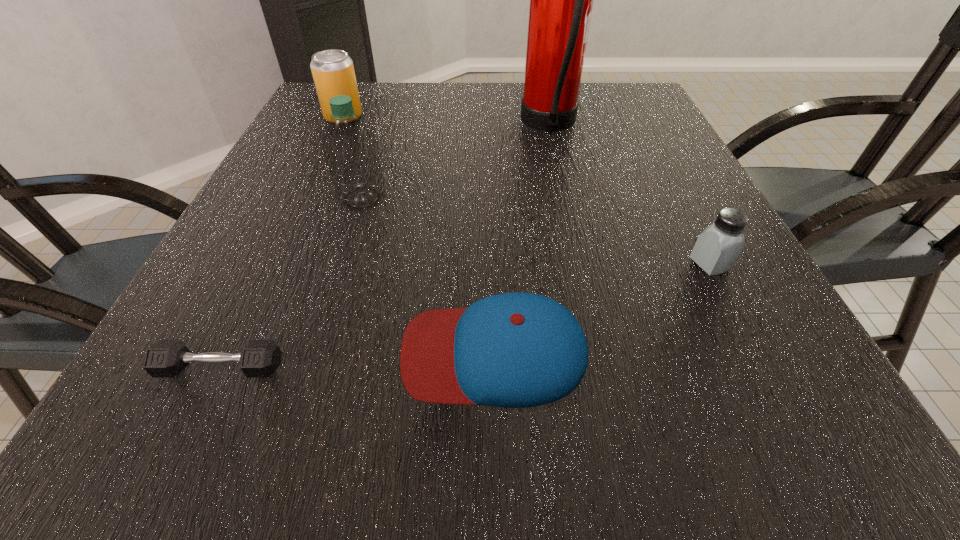
This screenshot has height=540, width=960. Find the location of `vacant point located on the front of the pop (soda)`. vacant point located on the front of the pop (soda) is located at coordinates (313, 184).

At what (x,y) coordinates should I click in order to perform the action: click on free region located 0.060m on the left of the rightmost object. Please return your answer as a coordinate pair (x, y). This screenshot has height=540, width=960. Looking at the image, I should click on (657, 264).

This screenshot has width=960, height=540. In order to click on free space located 0.140m with the bill of the second shortest object facing forward in this screenshot , I will do `click(304, 353)`.

This screenshot has width=960, height=540. I want to click on vacant space located with the bill of the second shortest object facing forward, so click(x=178, y=353).

Find the location of `free space located with the bill of the second shortest object facing forward`. free space located with the bill of the second shortest object facing forward is located at coordinates 248,353.

Find the location of `vacant space situated 0.210m on the back of the dumbbell`. vacant space situated 0.210m on the back of the dumbbell is located at coordinates (275, 254).

Where is `fire extinguisher located at the far edge`? This screenshot has width=960, height=540. fire extinguisher located at the far edge is located at coordinates (561, 0).

Find the location of a particular element. pop (soda) at the far edge is located at coordinates (333, 72).

At what (x,y) coordinates should I click in order to perform the action: click on object located in the near edge section of the desktop. Please return your answer as a coordinate pair (x, y). Looking at the image, I should click on (515, 350).

Image resolution: width=960 pixels, height=540 pixels. I want to click on pop (soda) situated at the left edge, so click(333, 72).